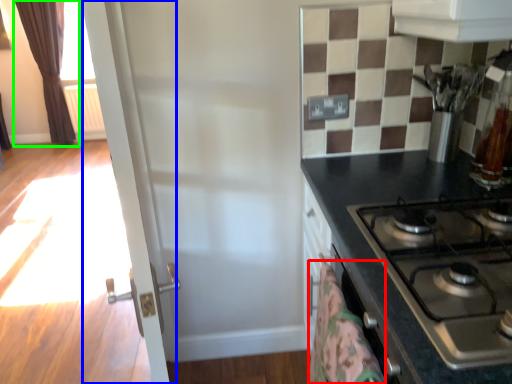
Question: Estimate the real-world distances between objects in this image. Which object is closer to blanket (highlighted by a red box), screen door (highlighted by a blue box) or curtain (highlighted by a green box)?

Choices:
 (A) screen door
 (B) curtain

Answer: (A)